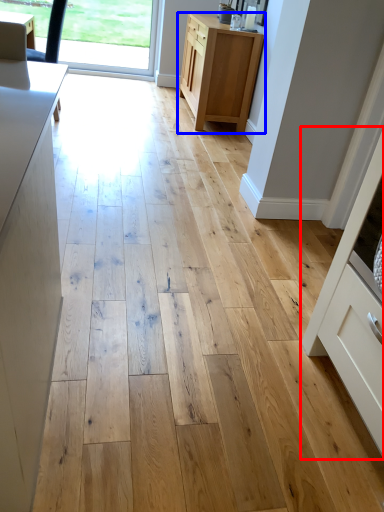
Question: Which point is closer to the camera, cabinetry (highlighted by a red box) or cabinetry (highlighted by a blue box)?

Choices:
 (A) cabinetry
 (B) cabinetry

Answer: (A)